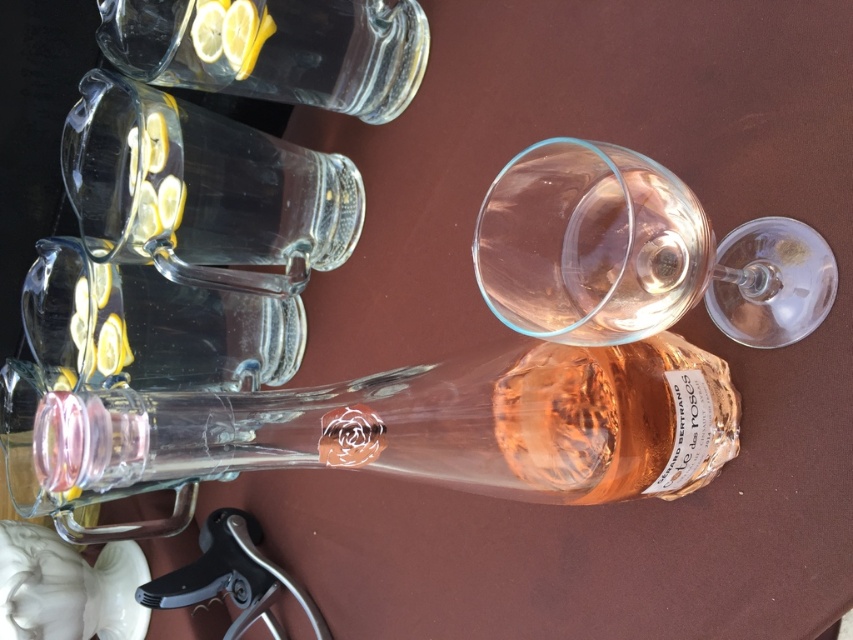
Can you confirm if transparent glass wine glass at center is taller than transparent glass carafe at upper left?

In fact, transparent glass wine glass at center may be shorter than transparent glass carafe at upper left.

Who is lower down, transparent glass wine glass at center or transparent glass carafe at upper left?

Positioned lower is transparent glass wine glass at center.

Which is behind, point (682, 180) or point (175, 156)?

Point (175, 156)

Find the location of a particular element. This screenshot has height=640, width=853. transparent glass wine glass at center is located at coordinates (636, 253).

Which of these two, clear glass bottle at center or transparent glass wine glass at center, stands shorter?

With less height is clear glass bottle at center.

Who is more distant from viewer, (242, 444) or (538, 317)?

Point (242, 444)

Is point (141, 394) positioned in front of point (654, 266)?

No, it is behind (654, 266).

At what (x,y) coordinates should I click in order to perform the action: click on clear glass bottle at center. Please return your answer as a coordinate pair (x, y). The image size is (853, 640). Looking at the image, I should click on (426, 426).

Can you confirm if transparent glass wine glass at center is positioned to the left of clear glass carafe at upper left?

In fact, transparent glass wine glass at center is to the right of clear glass carafe at upper left.

Does point (614, 216) lie in front of point (178, 67)?

Yes, point (614, 216) is closer to viewer.

This screenshot has width=853, height=640. In order to click on transparent glass wine glass at center in this screenshot , I will do `click(636, 253)`.